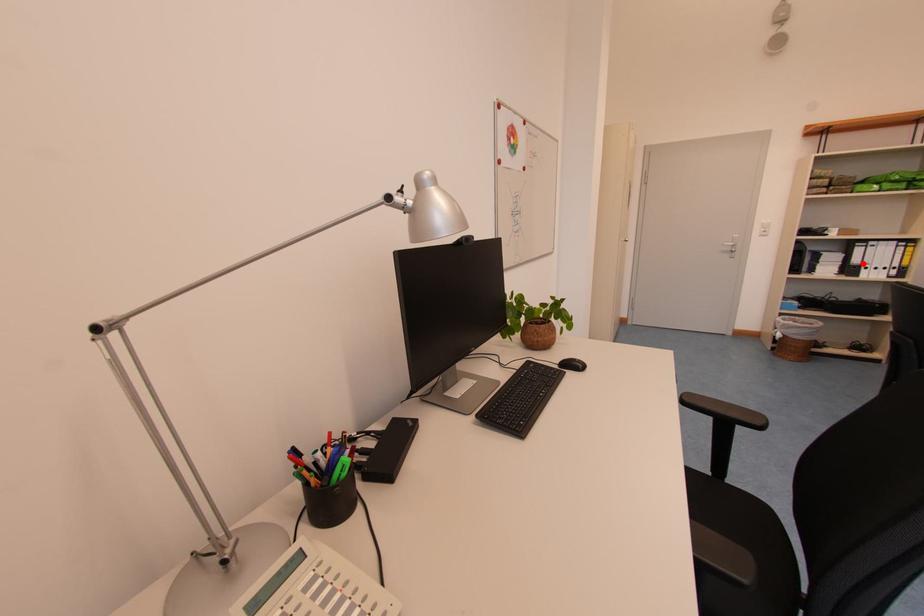
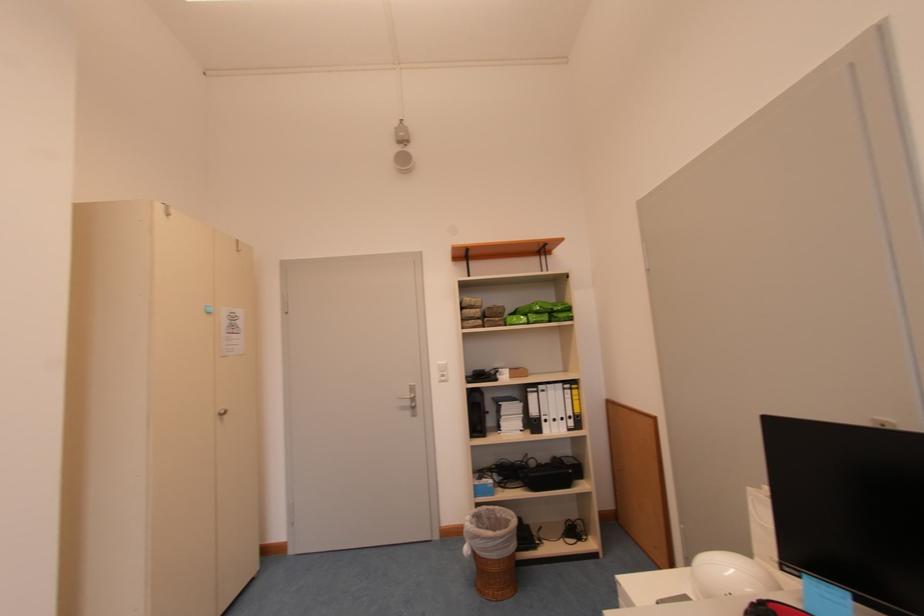
Question: I am providing you with two images of the same scene from different viewpoints. Given a red point in image1, look at the same physical point in image2. Is it:

Choices:
 (A) Closer to the viewpoint
 (B) Farther from the viewpoint

Answer: (B)